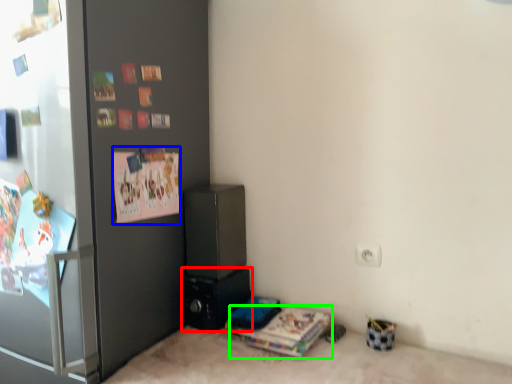
Question: Which object is positioned farthest from appliance (highlighted by a red box)? Select from postcard (highlighted by a blue box) and magazine (highlighted by a green box).

Choices:
 (A) postcard
 (B) magazine

Answer: (A)